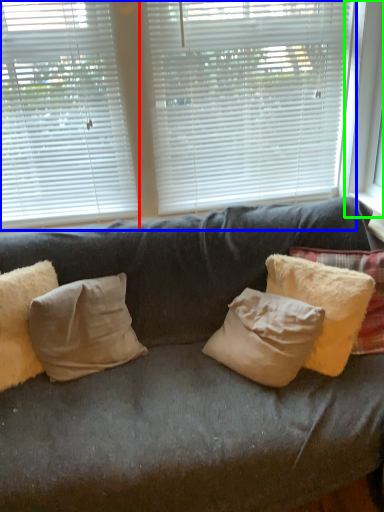
Question: Estimate the real-world distances between objects in this image. Which object is closer to window blind (highlighted by a red box), window blind (highlighted by a blue box) or window frame (highlighted by a green box)?

Choices:
 (A) window blind
 (B) window frame

Answer: (A)